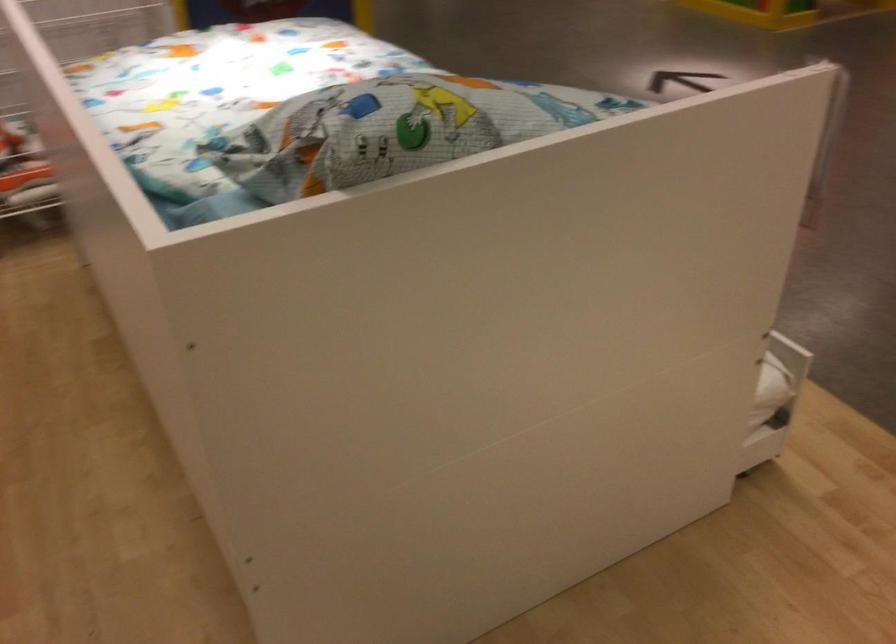
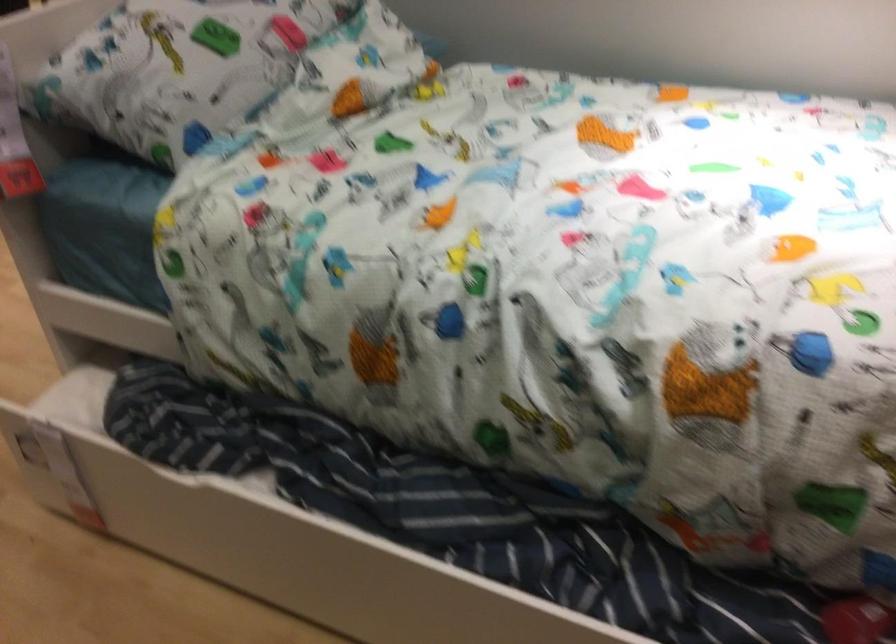
In the second image, find the point that corresponds to point 813,380 in the first image.

(24, 448)